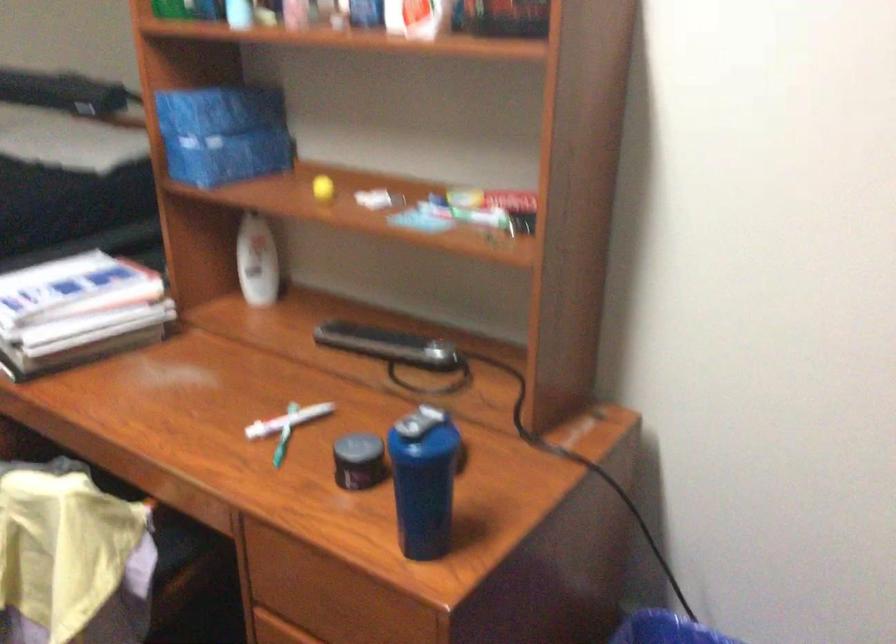
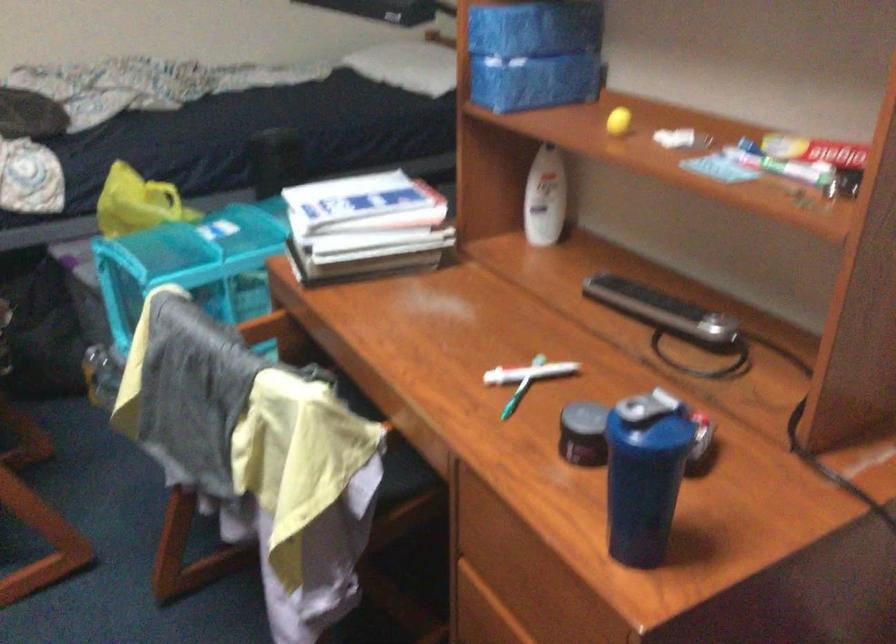
Locate, in the second image, the point that corresponds to the point at 234,154 in the first image.

(533, 82)